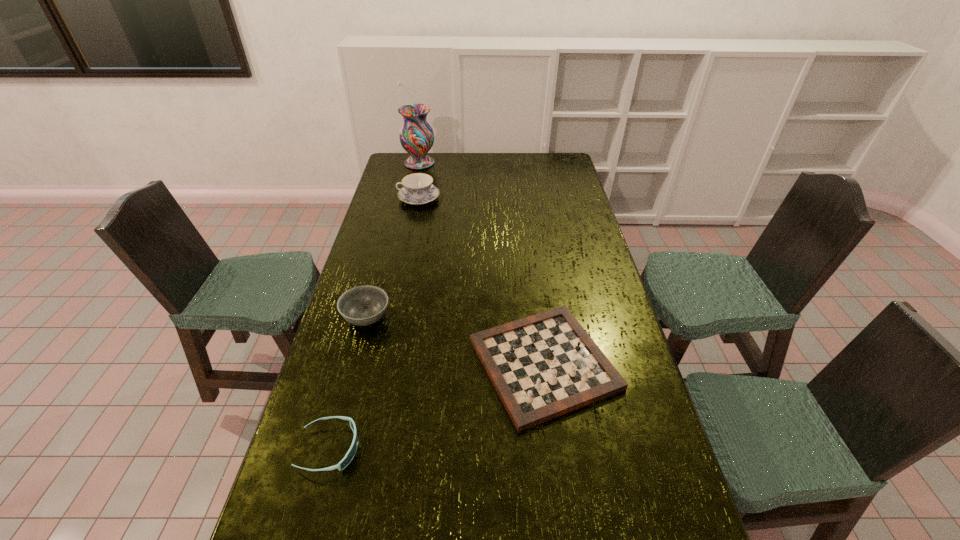
This screenshot has height=540, width=960. I want to click on the tallest object, so click(416, 135).

What are the coordinates of `the farthest object` in the screenshot? It's located at (416, 135).

You are a GUI agent. You are given a task and a screenshot of the screen. Output one action in this format:
    pyautogui.click(x=<x>, y=<y>)
    Task: Click on the second farthest object
    This screenshot has width=960, height=540.
    Given the screenshot: What is the action you would take?
    (418, 189)

The height and width of the screenshot is (540, 960). I want to click on the second tallest object, so click(418, 189).

Locate an element on the screen. The width and height of the screenshot is (960, 540). bowl is located at coordinates [364, 305].

The height and width of the screenshot is (540, 960). Find the location of `chessboard`. chessboard is located at coordinates (542, 366).

This screenshot has height=540, width=960. Find the location of `goggles`. goggles is located at coordinates (350, 454).

At what (x,y) coordinates should I click in order to perform the action: click on vacant space positioned 0.180m on the front of the farthest object. Please return your answer as a coordinate pair (x, y). This screenshot has height=540, width=960. Looking at the image, I should click on (414, 189).

Identify the location of vacant space located 0.090m with the handle on the side of the second tallest object. (377, 198).

Find the location of a particular element. Image resolution: width=960 pixels, height=540 pixels. free space located with the handle on the side of the second tallest object is located at coordinates (377, 198).